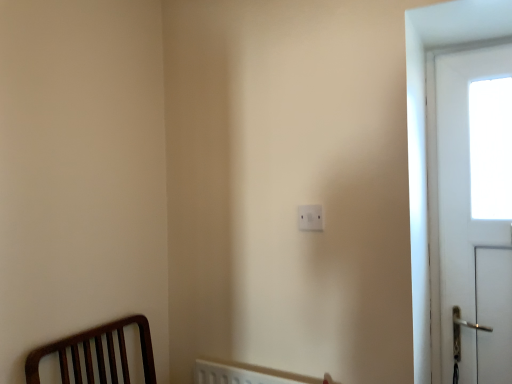
Question: Is the depth of white glossy door at right less than that of white plastic light switch at center?

Choices:
 (A) yes
 (B) no

Answer: (B)

Question: From the image's perspective, would you say white glossy door at right is positioned over white plastic light switch at center?

Choices:
 (A) yes
 (B) no

Answer: (A)

Question: Is the surface of white glossy door at right in direct contact with white plastic light switch at center?

Choices:
 (A) yes
 (B) no

Answer: (B)

Question: Are white glossy door at right and white plastic light switch at center far apart?

Choices:
 (A) no
 (B) yes

Answer: (A)

Question: Does white glossy door at right appear on the left side of white plastic light switch at center?

Choices:
 (A) no
 (B) yes

Answer: (A)

Question: Considering the relative sizes of white glossy door at right and white plastic light switch at center in the image provided, is white glossy door at right bigger than white plastic light switch at center?

Choices:
 (A) no
 (B) yes

Answer: (B)

Question: Is white plastic light switch at center positioned with its back to white glossy door at right?

Choices:
 (A) yes
 (B) no

Answer: (B)

Question: Does white plastic light switch at center have a lesser height compared to white glossy door at right?

Choices:
 (A) yes
 (B) no

Answer: (A)

Question: Considering the relative sizes of white plastic light switch at center and white glossy door at right in the image provided, is white plastic light switch at center smaller than white glossy door at right?

Choices:
 (A) yes
 (B) no

Answer: (A)

Question: Does white plastic light switch at center appear on the left side of white glossy door at right?

Choices:
 (A) yes
 (B) no

Answer: (A)

Question: Is white plastic light switch at center further to camera compared to white glossy door at right?

Choices:
 (A) yes
 (B) no

Answer: (B)

Question: Considering the relative sizes of white plastic light switch at center and white glossy door at right in the image provided, is white plastic light switch at center taller than white glossy door at right?

Choices:
 (A) no
 (B) yes

Answer: (A)

Question: Is white glossy door at right to the left or to the right of white plastic light switch at center in the image?

Choices:
 (A) right
 (B) left

Answer: (A)